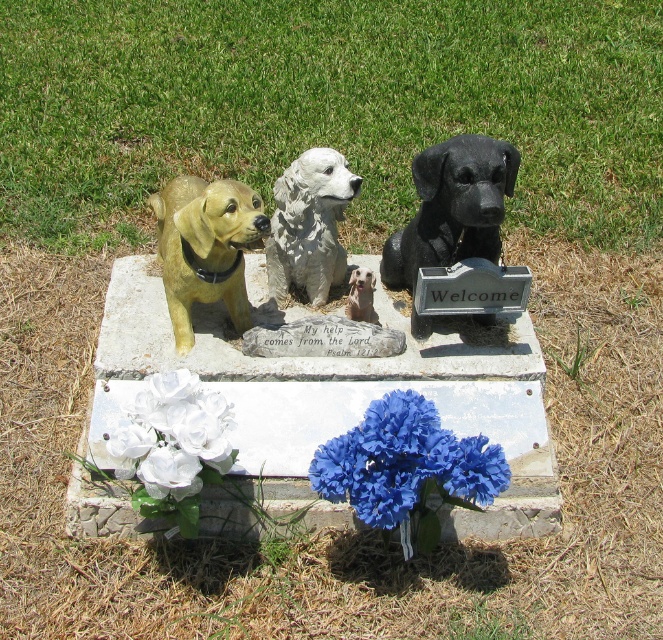
You are standing in front of the memorial marker and notice two statues on the top tier. The shiny black statue at center and the white glossy statue at center. Which one is shorter?

The shiny black statue at center is shorter than the white glossy statue at center.

You are a visitor at the memorial and want to place a blue fabric flowers at center on the memorial marker. The shiny black statue at center is already present. Where should you place the flowers?

The blue fabric flowers at center should be placed under the shiny black statue at center as per the memorial marker arrangement.

What are the coordinates of the shiny black statue at center?

The shiny black statue at center is located at coordinates point (452, 205).